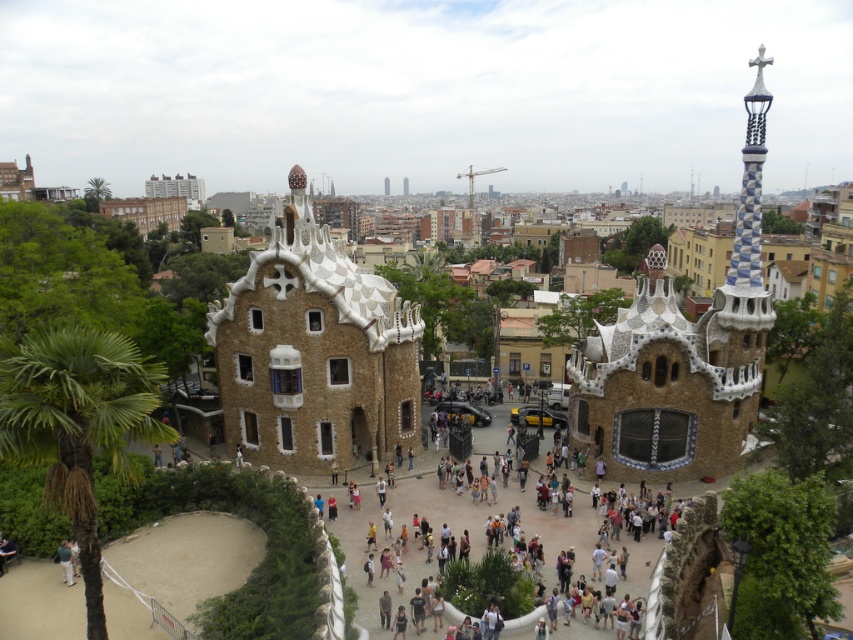
Who is lower down, white mosaic building at center or white mosaic church at center?

white mosaic church at center is below.

Can you confirm if white mosaic building at center is shorter than white mosaic church at center?

No.

Is point (289, 301) positioned in front of point (653, 273)?

Yes, point (289, 301) is closer to viewer.

The image size is (853, 640). Find the location of `white mosaic building at center`. white mosaic building at center is located at coordinates (314, 353).

Can you confirm if white mosaic building at center is taller than green fabric shirt at lower left?

Yes, white mosaic building at center is taller than green fabric shirt at lower left.

Between white mosaic building at center and green fabric shirt at lower left, which one is positioned lower?

green fabric shirt at lower left is below.

Is point (393, 294) farther from viewer compared to point (68, 547)?

Yes, point (393, 294) is farther from viewer.

I want to click on white mosaic building at center, so click(x=314, y=353).

Consider the image. Is white mosaic building at center further to the viewer compared to green leafy palm tree at lower left?

Yes, it is behind green leafy palm tree at lower left.

Between white mosaic building at center and green leafy palm tree at lower left, which one has less height?

Standing shorter between the two is green leafy palm tree at lower left.

Who is more forward, (380, 355) or (128, 413)?

Point (128, 413) is more forward.

At what (x,y) coordinates should I click in order to perform the action: click on white mosaic building at center. Please return your answer as a coordinate pair (x, y). This screenshot has height=640, width=853. Looking at the image, I should click on (314, 353).